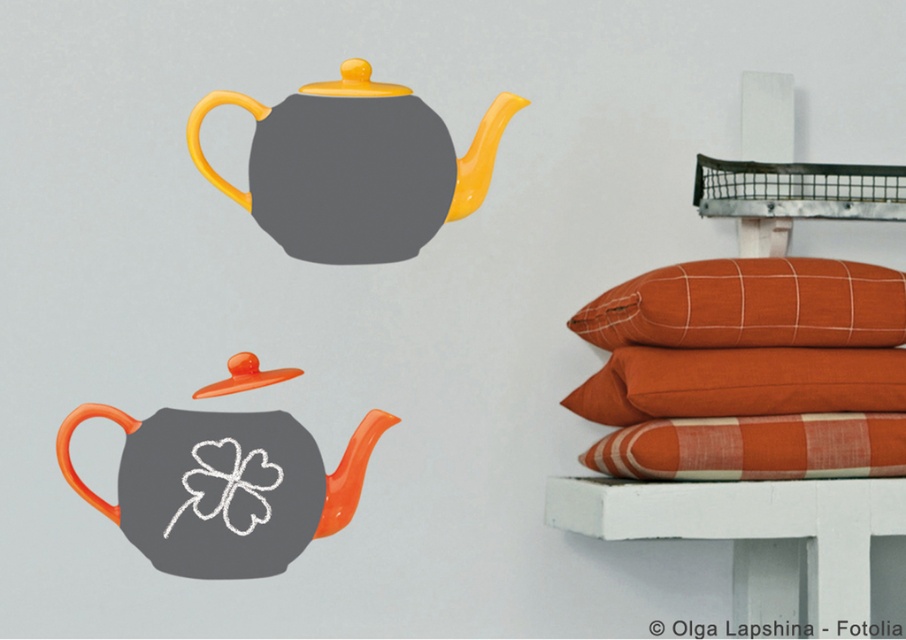
Does matte orange teapot at center appear on the left side of orange cotton pillow at right?

Yes, matte orange teapot at center is to the left of orange cotton pillow at right.

How far apart are matte orange teapot at center and orange cotton pillow at right?

A distance of 12.71 inches exists between matte orange teapot at center and orange cotton pillow at right.

Locate an element on the screen. The width and height of the screenshot is (906, 640). matte orange teapot at center is located at coordinates (224, 486).

Can you confirm if matte orange teapot at center is bigger than orange cotton pillow at upper right?

Yes.

Where is `matte orange teapot at center`? This screenshot has width=906, height=640. matte orange teapot at center is located at coordinates (224, 486).

Is orange cotton pillow at upper right to the left of orange plaid pillow at right from the viewer's perspective?

Yes, orange cotton pillow at upper right is to the left of orange plaid pillow at right.

Can you confirm if orange cotton pillow at upper right is taller than orange plaid pillow at right?

Correct, orange cotton pillow at upper right is much taller as orange plaid pillow at right.

This screenshot has width=906, height=640. What are the coordinates of `orange cotton pillow at upper right` in the screenshot? It's located at (750, 305).